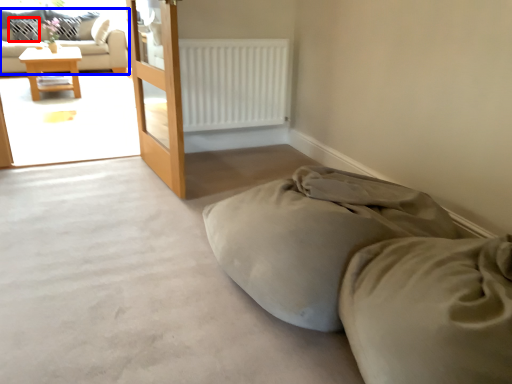
Question: Which object appears closest to the camera in this image, pillow (highlighted by a red box) or studio couch (highlighted by a blue box)?

Choices:
 (A) pillow
 (B) studio couch

Answer: (B)